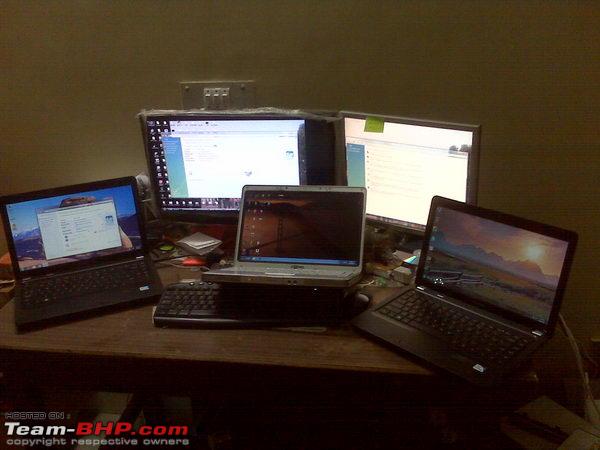
Look for post it note in the image and show me where they are. Your answer should be formatted as a list of tuples, i.e. [(x1, y1), (x2, y2), ...], where each tuple contains the x and y coordinates of a point satisfying the conditions above.

[(382, 127)]